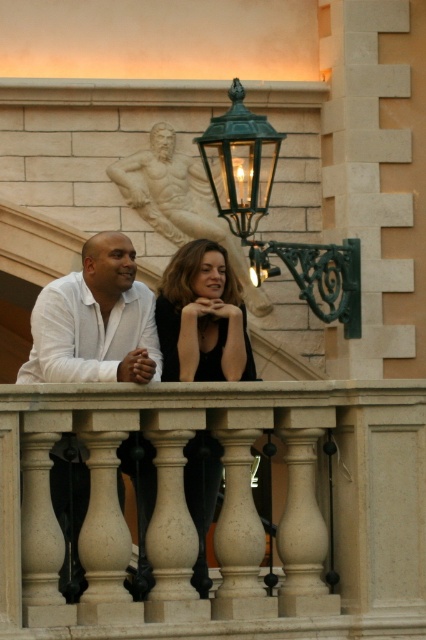
Is black matte dress at center to the left of bronze statue at upper center from the viewer's perspective?

In fact, black matte dress at center is to the right of bronze statue at upper center.

This screenshot has height=640, width=426. Find the location of `black matte dress at center`. black matte dress at center is located at coordinates 203,317.

Is white marble balustrade at center thinner than green metal lantern at upper center?

In fact, white marble balustrade at center might be wider than green metal lantern at upper center.

Can you confirm if white marble balustrade at center is shorter than green metal lantern at upper center?

Correct, white marble balustrade at center is not as tall as green metal lantern at upper center.

What do you see at coordinates (221, 512) in the screenshot? The image size is (426, 640). I see `white marble balustrade at center` at bounding box center [221, 512].

At what (x,y) coordinates should I click in order to perform the action: click on white marble balustrade at center. Please return your answer as a coordinate pair (x, y). Looking at the image, I should click on (221, 512).

Which is above, white marble balustrade at center or white matte shirt at center?

white matte shirt at center is higher up.

Is point (94, 406) more distant than point (112, 278)?

No, it is not.

Find the location of a particular element. white marble balustrade at center is located at coordinates (221, 512).